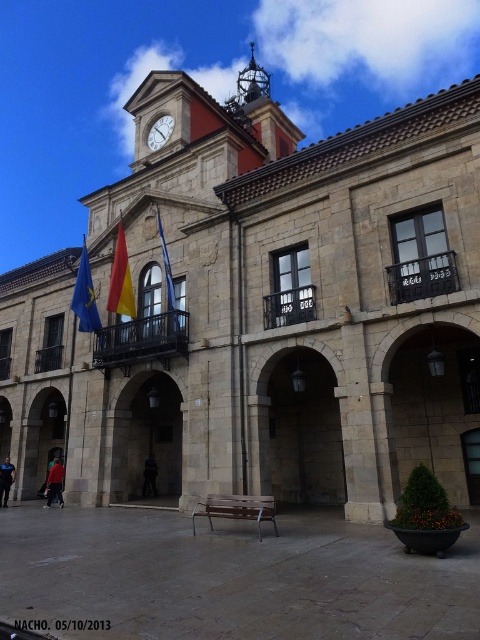
You are standing in front of the historic building and see the point marked at coordinates (231, 577). What object is located at that point?

The point at coordinates (231, 577) corresponds to the brown wooden bench at center.

You are a tourist standing in front of the historic building. You want to sit down on the brown wooden bench at center while still being able to see the blue fabric flag at left. Is the bench positioned in a way that allows you to see the flag without moving?

The brown wooden bench at center is below the blue fabric flag at left, so yes, you can see the flag while sitting on the bench because it is positioned above the bench.